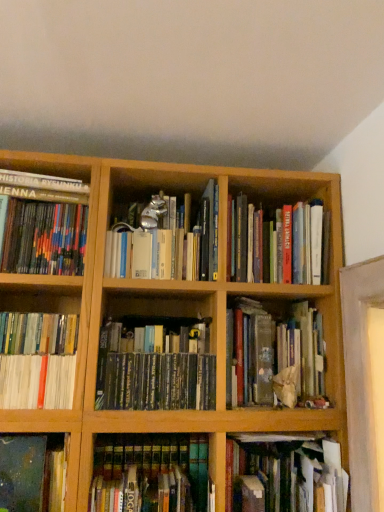
Question: Can you confirm if dark blue matte book at lower left, acting as the 7th book starting from the right, is thinner than white glossy book at lower left, the second book positioned from the left?

Choices:
 (A) no
 (B) yes

Answer: (B)

Question: From the image's perspective, is dark blue matte book at lower left, which is the 3th book from left to right, above white glossy book at lower left, the eighth book in the right-to-left sequence?

Choices:
 (A) no
 (B) yes

Answer: (A)

Question: Does dark blue matte book at lower left, acting as the 7th book starting from the right, turn towards white glossy book at lower left, the eighth book in the right-to-left sequence?

Choices:
 (A) no
 (B) yes

Answer: (A)

Question: Is dark blue matte book at lower left, acting as the 7th book starting from the right, positioned with its back to white glossy book at lower left, the eighth book in the right-to-left sequence?

Choices:
 (A) yes
 (B) no

Answer: (B)

Question: Considering the relative sizes of dark blue matte book at lower left, which is the 3th book from left to right, and white glossy book at lower left, the second book positioned from the left, in the image provided, is dark blue matte book at lower left, which is the 3th book from left to right, smaller than white glossy book at lower left, the second book positioned from the left,?

Choices:
 (A) no
 (B) yes

Answer: (B)

Question: Considering the positions of multicolored hardcover books at left, acting as the first book starting from the left, and dark blue matte book at lower left, which is the 3th book from left to right, in the image, is multicolored hardcover books at left, acting as the first book starting from the left, taller or shorter than dark blue matte book at lower left, which is the 3th book from left to right,?

Choices:
 (A) tall
 (B) short

Answer: (A)

Question: From a real-world perspective, is multicolored hardcover books at left, the 9th book from the right, physically located above or below dark blue matte book at lower left, acting as the 7th book starting from the right?

Choices:
 (A) below
 (B) above

Answer: (B)

Question: From the image's perspective, is multicolored hardcover books at left, the 9th book from the right, above or below dark blue matte book at lower left, acting as the 7th book starting from the right?

Choices:
 (A) above
 (B) below

Answer: (A)

Question: Is point (48, 201) positioned closer to the camera than point (56, 453)?

Choices:
 (A) closer
 (B) farther

Answer: (B)

Question: From the image's perspective, is hardcover books at center, placed as the fifth book when sorted from right to left, located above or below green matte book at center, acting as the fourth book starting from the left?

Choices:
 (A) below
 (B) above

Answer: (A)

Question: Is hardcover books at center, the fifth book viewed from the left, spatially inside green matte book at center, acting as the fourth book starting from the left, or outside of it?

Choices:
 (A) outside
 (B) inside

Answer: (A)

Question: Looking at the image, does hardcover books at center, the fifth book viewed from the left, seem bigger or smaller compared to green matte book at center, acting as the fourth book starting from the left?

Choices:
 (A) small
 (B) big

Answer: (A)

Question: Is hardcover books at center, the fifth book viewed from the left, to the left or to the right of green matte book at center, acting as the fourth book starting from the left, in the image?

Choices:
 (A) left
 (B) right

Answer: (B)

Question: Visually, is hardcover books at center, placed as the 8th book when sorted from left to right, positioned to the left or to the right of hardcover book at lower center, which is counted as the third book, starting from the right?

Choices:
 (A) right
 (B) left

Answer: (A)

Question: Choose the correct answer: Is hardcover books at center, the second book viewed from the right, inside hardcover book at lower center, which is counted as the third book, starting from the right, or outside it?

Choices:
 (A) outside
 (B) inside

Answer: (A)